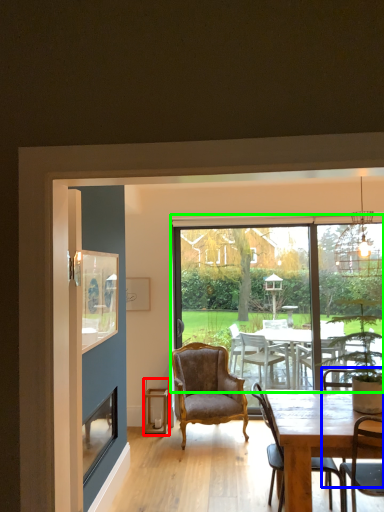
Question: Which is farther away from lantern (highlighted by a red box)? armchair (highlighted by a blue box) or window (highlighted by a green box)?

Choices:
 (A) armchair
 (B) window

Answer: (A)